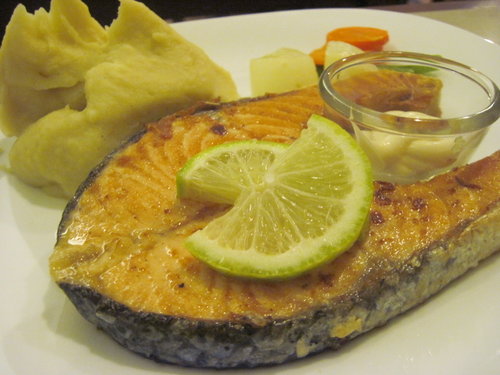
The width and height of the screenshot is (500, 375). In order to click on bowl in this screenshot , I will do `click(435, 133)`.